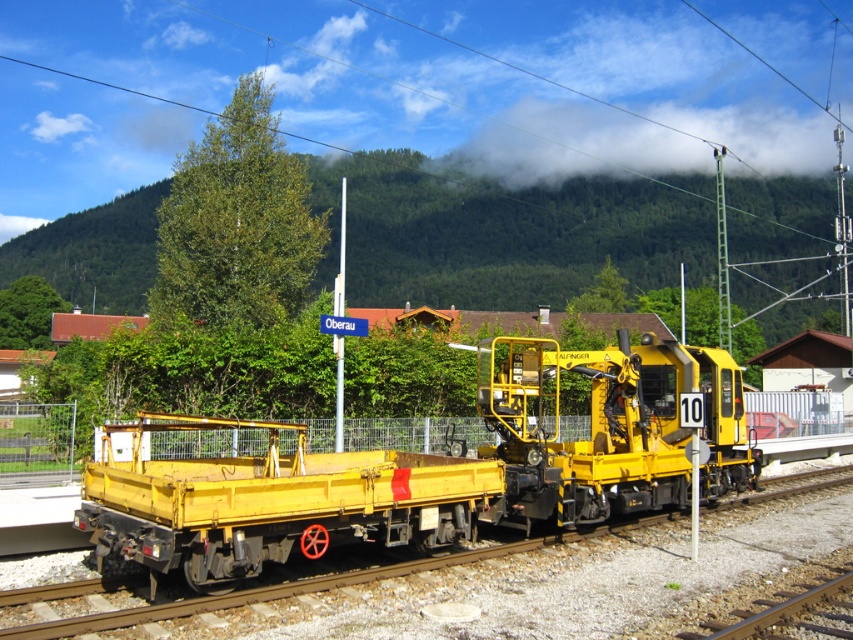
Based on the scene description, where exactly is the yellow matte train car at center located in the image?

The yellow matte train car at center is located at point coordinates of (426, 468).

You are a railway inspector checking the rail grinder. You notice the yellow metal train track at center and the matte yellow flatbed at center. Which object is located below the other?

The yellow metal train track at center is positioned under the matte yellow flatbed at center.